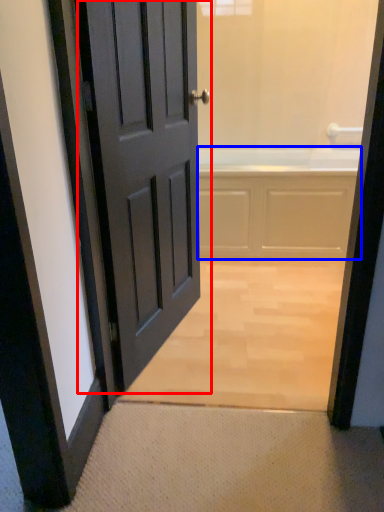
Question: Which point is further to the camera, door (highlighted by a red box) or bath (highlighted by a blue box)?

Choices:
 (A) door
 (B) bath

Answer: (B)